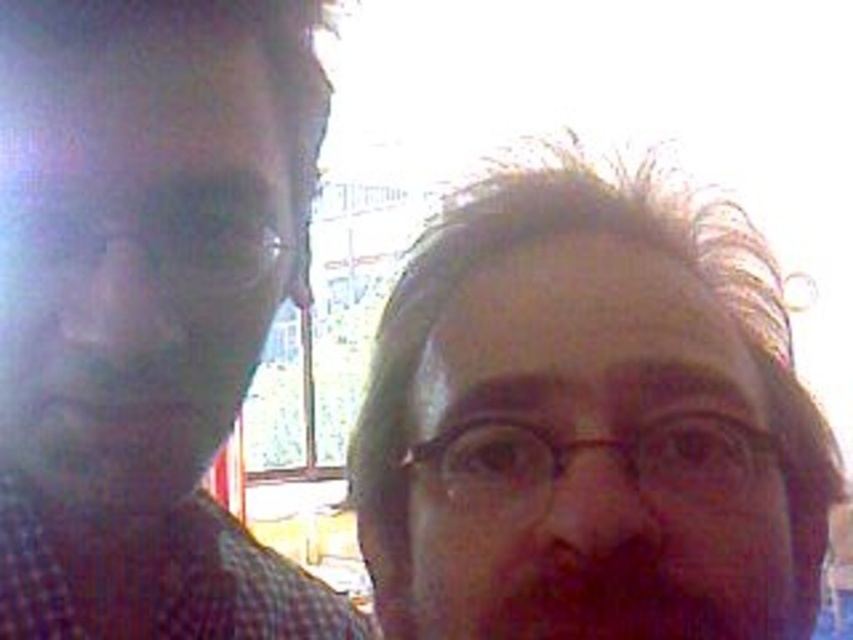
Question: Considering the relative positions of matte plastic face at center and matte black shirt at left in the image provided, where is matte plastic face at center located with respect to matte black shirt at left?

Choices:
 (A) above
 (B) below

Answer: (A)

Question: Is matte plastic face at center to the right of matte black shirt at left from the viewer's perspective?

Choices:
 (A) yes
 (B) no

Answer: (A)

Question: Which point is farther to the camera?

Choices:
 (A) (109, 4)
 (B) (485, 385)

Answer: (A)

Question: Is matte plastic face at center to the left of matte black shirt at left from the viewer's perspective?

Choices:
 (A) no
 (B) yes

Answer: (A)